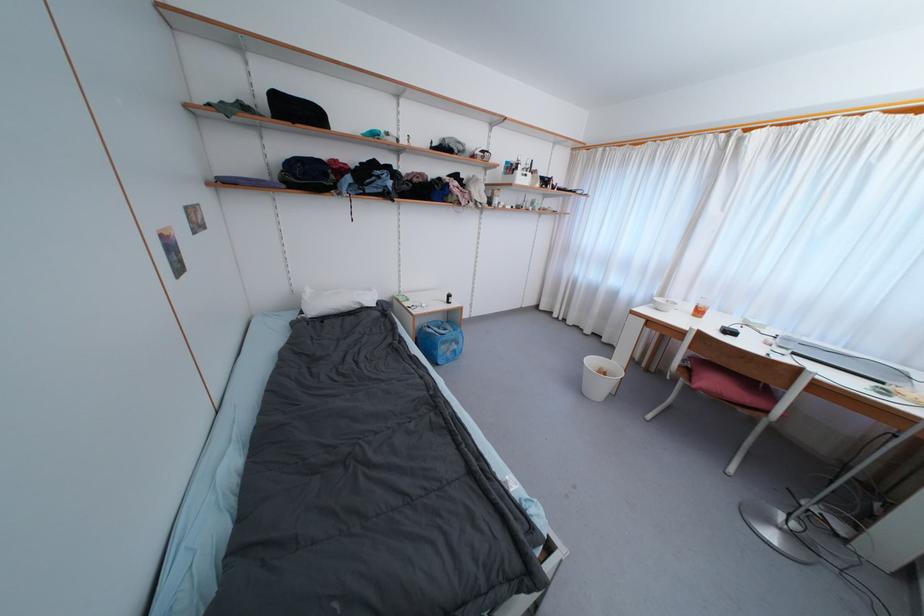
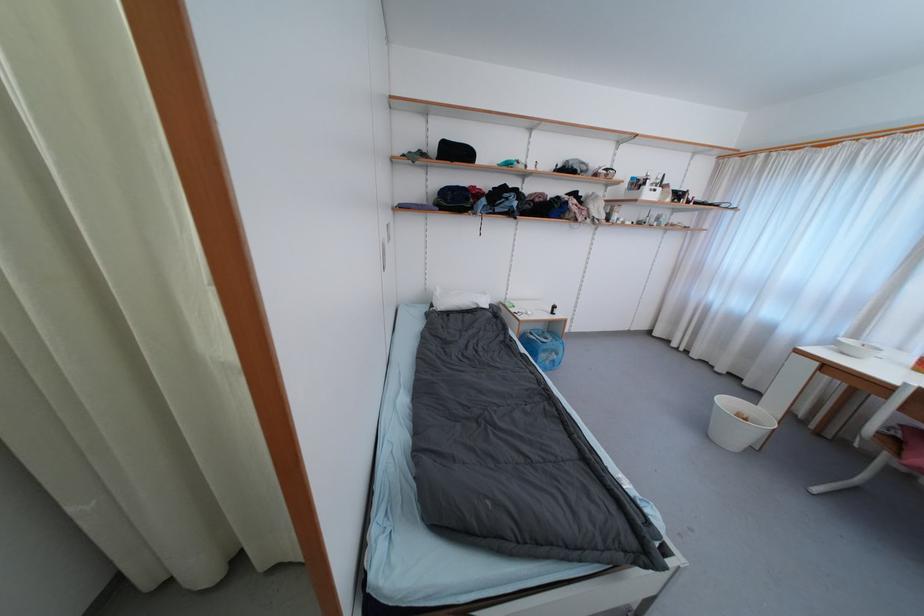
The point at (456, 302) is marked in the first image. Where is the corresponding point in the second image?

(560, 313)